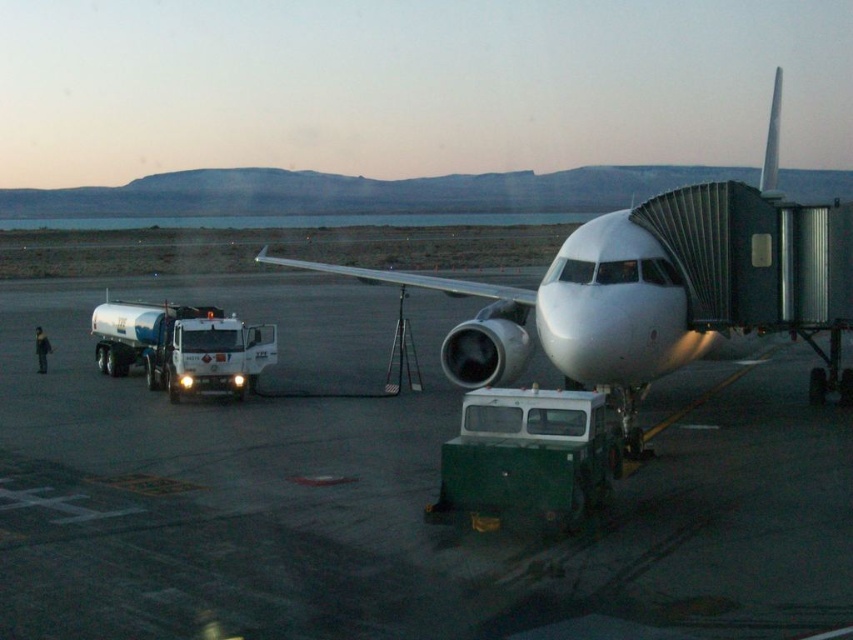
Looking at this image, can you confirm if white glossy airplane at center is taller than green matte truck at lower center?

Yes.

Describe the element at coordinates (573, 316) in the screenshot. This screenshot has height=640, width=853. I see `white glossy airplane at center` at that location.

In order to click on white glossy airplane at center in this screenshot , I will do `click(573, 316)`.

This screenshot has width=853, height=640. What do you see at coordinates (392, 506) in the screenshot?
I see `smooth asphalt tarmac at center` at bounding box center [392, 506].

Who is more forward, (346, 588) or (575, 513)?

Point (346, 588)

Which is behind, point (363, 369) or point (518, 509)?

The point (363, 369) is behind.

Find the location of a particular element. This screenshot has width=853, height=640. smooth asphalt tarmac at center is located at coordinates (392, 506).

Does green matte truck at lower center appear on the left side of white glossy fuel truck at left?

Incorrect, green matte truck at lower center is not on the left side of white glossy fuel truck at left.

Based on the photo, does green matte truck at lower center have a greater height compared to white glossy fuel truck at left?

Correct, green matte truck at lower center is much taller as white glossy fuel truck at left.

You are a GUI agent. You are given a task and a screenshot of the screen. Output one action in this format:
    pyautogui.click(x=<x>, y=<y>)
    Task: Click on the green matte truck at lower center
    The width and height of the screenshot is (853, 640).
    Given the screenshot: What is the action you would take?
    pyautogui.click(x=529, y=456)